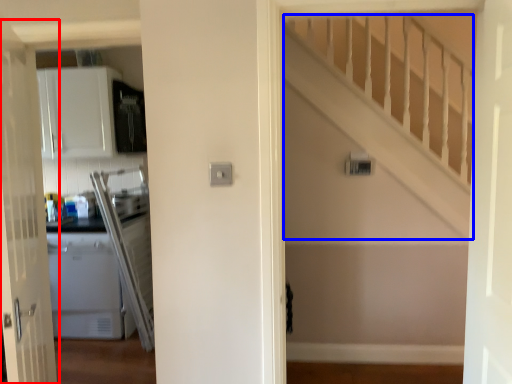
Question: Among these objects, which one is nearest to the camera, door (highlighted by a red box) or stairwell (highlighted by a blue box)?

Choices:
 (A) door
 (B) stairwell

Answer: (A)